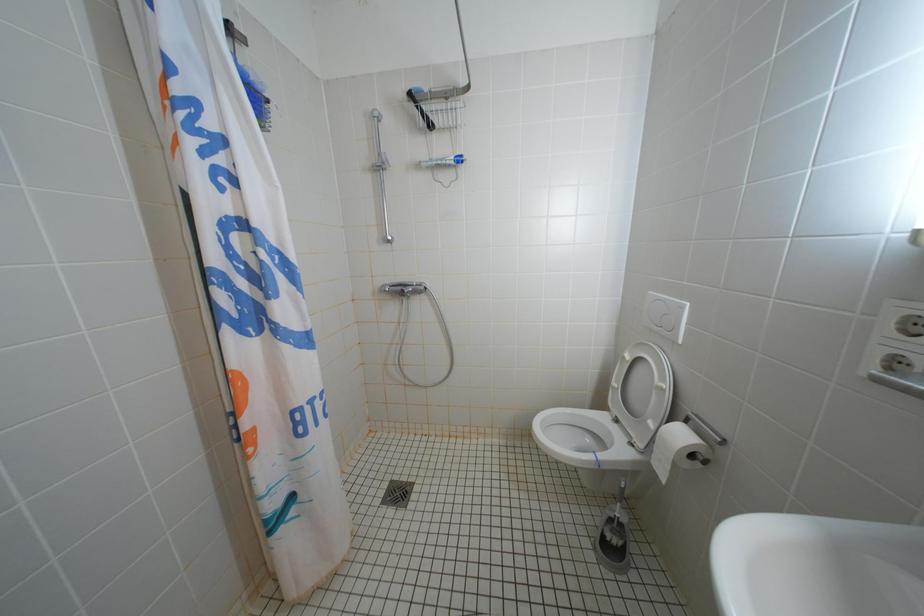
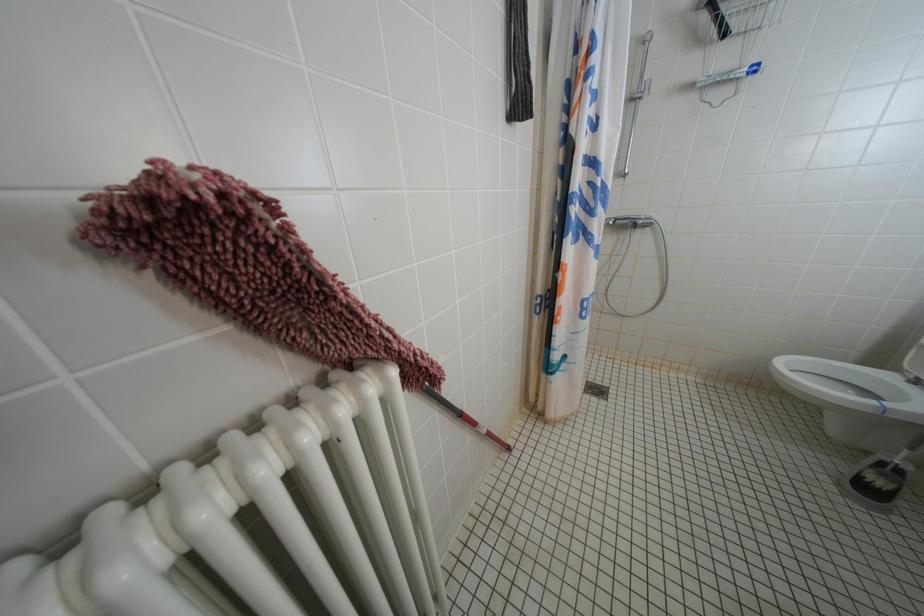
Question: Based on the continuous images, in which direction is the camera rotating? Reply with the corresponding letter.

Choices:
 (A) Left
 (B) Right
 (C) Up
 (D) Down

Answer: (A)